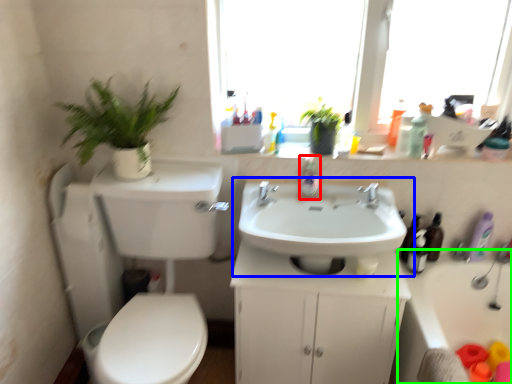
Question: Which object is the farthest from soap dispenser (highlighted by a red box)? Choose among these: sink (highlighted by a blue box) or bath (highlighted by a green box).

Choices:
 (A) sink
 (B) bath

Answer: (B)